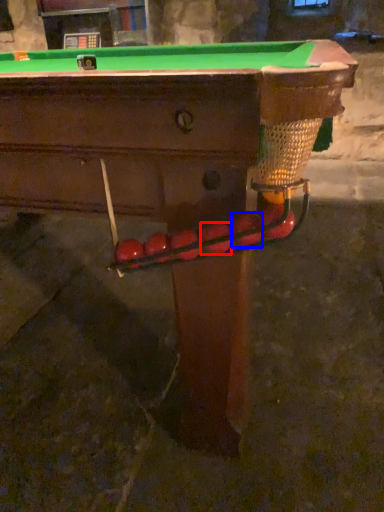
Question: Which of the following is the closest to the observer, fruit (highlighted by a red box) or fruit (highlighted by a blue box)?

Choices:
 (A) fruit
 (B) fruit

Answer: (B)